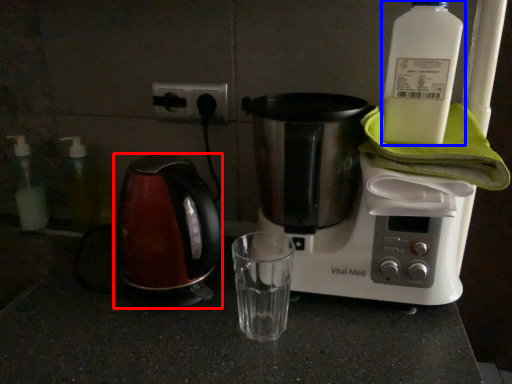
Question: Among these objects, which one is nearest to the camera, kettle (highlighted by a red box) or bottle (highlighted by a blue box)?

Choices:
 (A) kettle
 (B) bottle

Answer: (B)